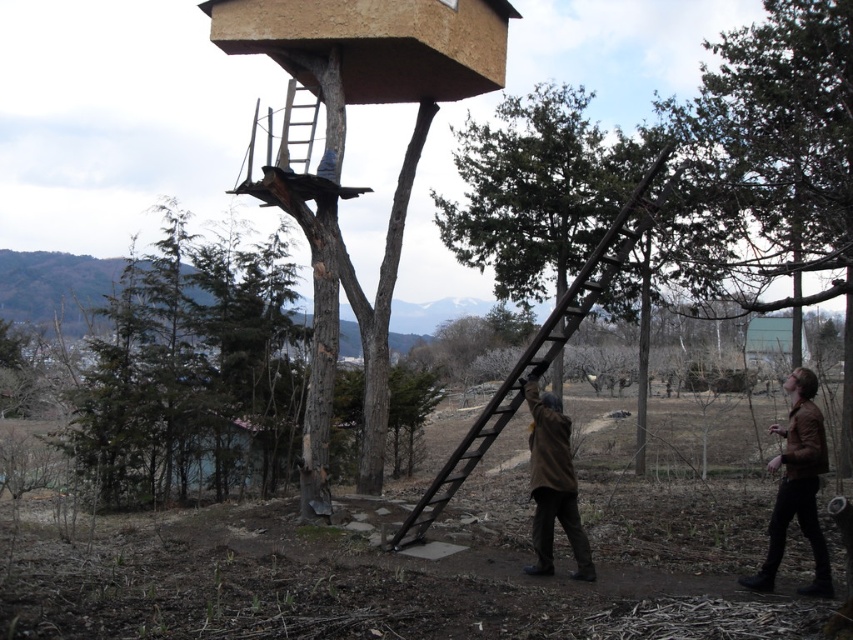
Does rusty metal ladder at center have a larger size compared to brown woolen coat at lower center?

Indeed, rusty metal ladder at center has a larger size compared to brown woolen coat at lower center.

Can you confirm if rusty metal ladder at center is positioned above brown woolen coat at lower center?

Indeed, rusty metal ladder at center is positioned over brown woolen coat at lower center.

Which is in front, point (526, 348) or point (550, 573)?

Point (550, 573) is more forward.

I want to click on rusty metal ladder at center, so (538, 349).

Is brown leather jacket at lower right to the left of wooden at center from the viewer's perspective?

No, brown leather jacket at lower right is not to the left of wooden at center.

Locate an element on the screen. brown leather jacket at lower right is located at coordinates (798, 486).

Does brown leather jacket at lower right have a greater width compared to brown woolen coat at lower center?

Indeed, brown leather jacket at lower right has a greater width compared to brown woolen coat at lower center.

I want to click on brown leather jacket at lower right, so click(798, 486).